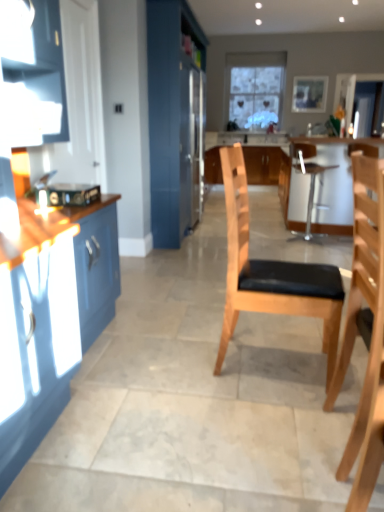
This screenshot has width=384, height=512. I want to click on free point below natural wood chair at center, marked as the first chair in a front-to-back arrangement (from a real-world perspective), so click(337, 432).